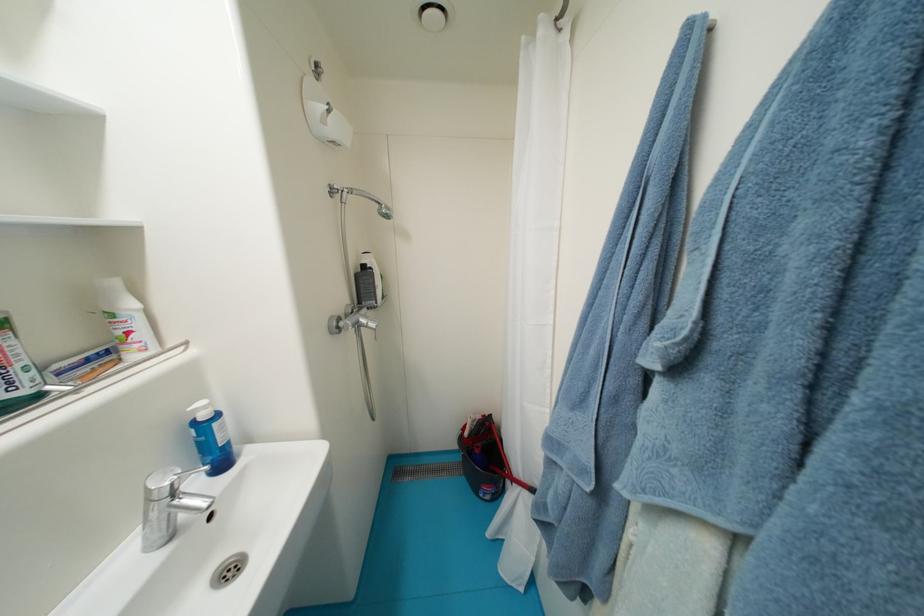
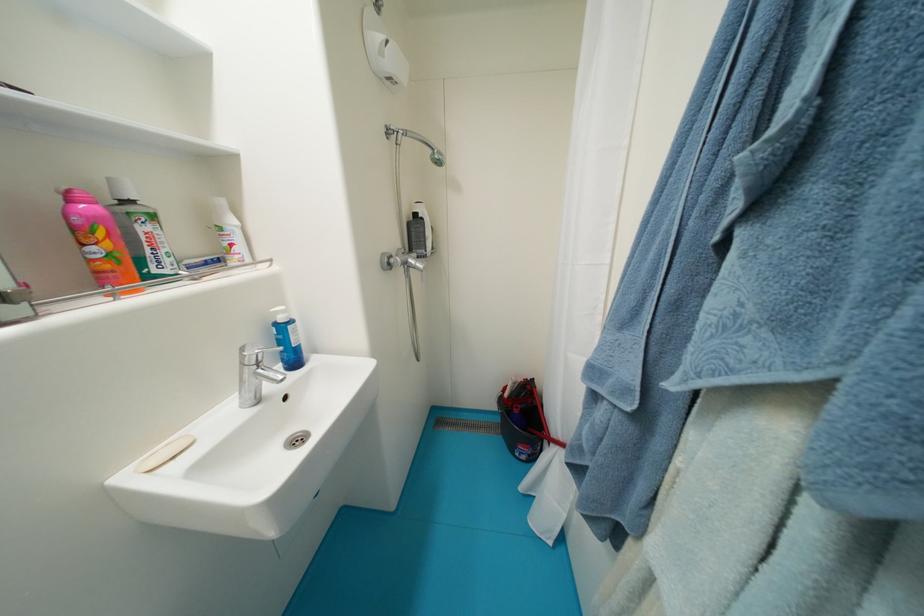
Question: Which direction would the cameraman need to move to produce the second image? Reply with the corresponding letter.

Choices:
 (A) Left
 (B) Right
 (C) Forward
 (D) Backward

Answer: (B)